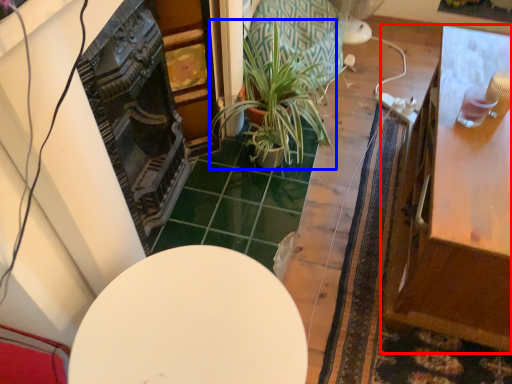
Question: Which object is closer to the camera taking this photo, table (highlighted by a red box) or houseplant (highlighted by a blue box)?

Choices:
 (A) table
 (B) houseplant

Answer: (A)